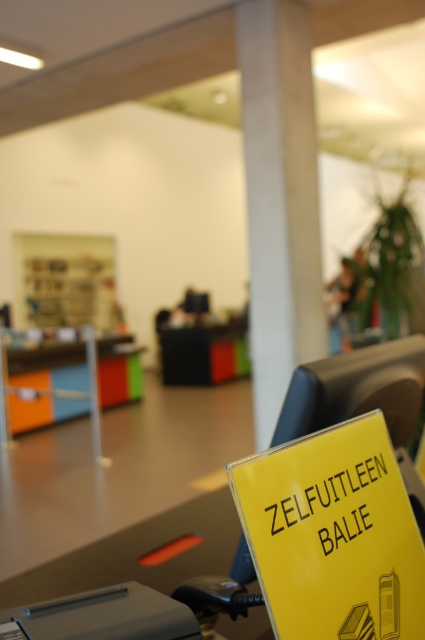
Does orange plastic desk at center appear on the right side of wooden bookshelf at center?

Yes, orange plastic desk at center is to the right of wooden bookshelf at center.

Which is above, orange plastic desk at center or wooden bookshelf at center?

wooden bookshelf at center is above.

Is point (51, 364) closer to camera compared to point (87, 308)?

Yes, it is.

What are the coordinates of `orange plastic desk at center` in the screenshot? It's located at click(67, 380).

Can you confirm if orange plastic desk at center is bigger than black plastic desk at center?

Indeed, orange plastic desk at center has a larger size compared to black plastic desk at center.

Locate an element on the screen. This screenshot has width=425, height=640. orange plastic desk at center is located at coordinates (67, 380).

Is gray plastic printer at lower left positioned at the back of black plastic desk at center?

No.

Which is more to the right, gray plastic printer at lower left or black plastic desk at center?

From the viewer's perspective, gray plastic printer at lower left appears more on the right side.

Who is more distant from viewer, (45, 621) or (206, 364)?

The point (206, 364) is behind.

At what (x,y) coordinates should I click in order to perform the action: click on gray plastic printer at lower left. Please return your answer as a coordinate pair (x, y). The image size is (425, 640). Looking at the image, I should click on (102, 616).